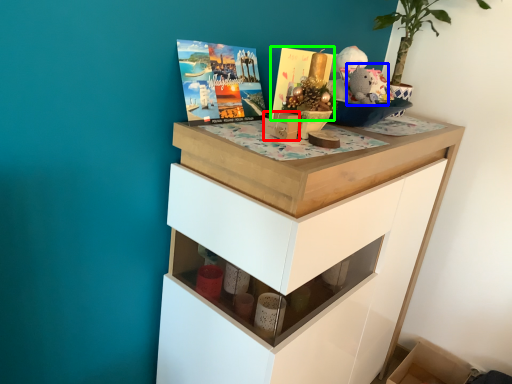
Question: Which object is the farthest from box (highlighted by a red box)? Choose among these: animal (highlighted by a blue box) or magazine (highlighted by a green box).

Choices:
 (A) animal
 (B) magazine

Answer: (A)